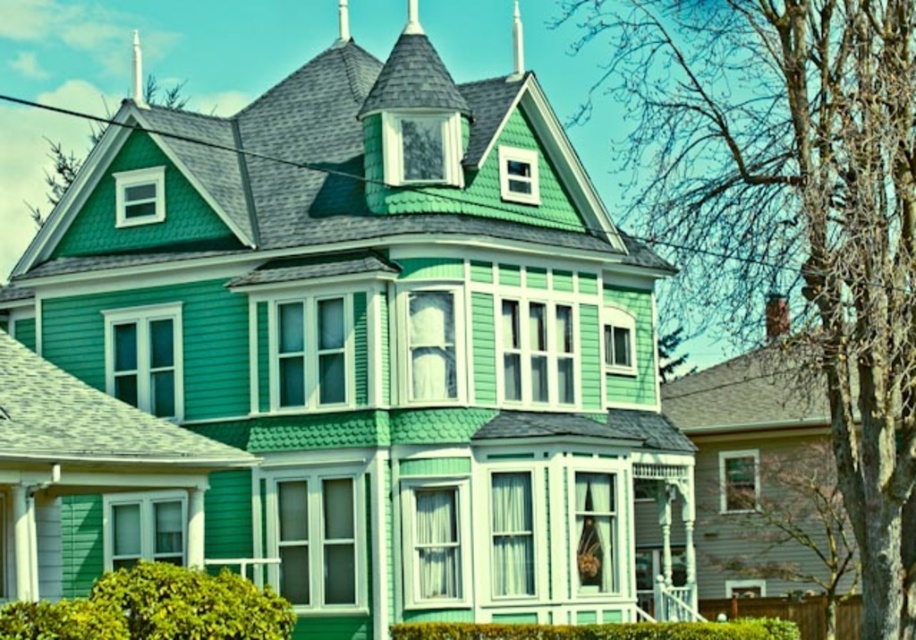
Can you confirm if smooth white spire at upper center is wider than metallic spire at upper center?

No, smooth white spire at upper center is not wider than metallic spire at upper center.

You are a GUI agent. You are given a task and a screenshot of the screen. Output one action in this format:
    pyautogui.click(x=<x>, y=<y>)
    Task: Click on the smooth white spire at upper center
    Image resolution: width=916 pixels, height=640 pixels.
    Given the screenshot: What is the action you would take?
    pyautogui.click(x=518, y=42)

Identify the location of smooth white spire at upper center. (518, 42).